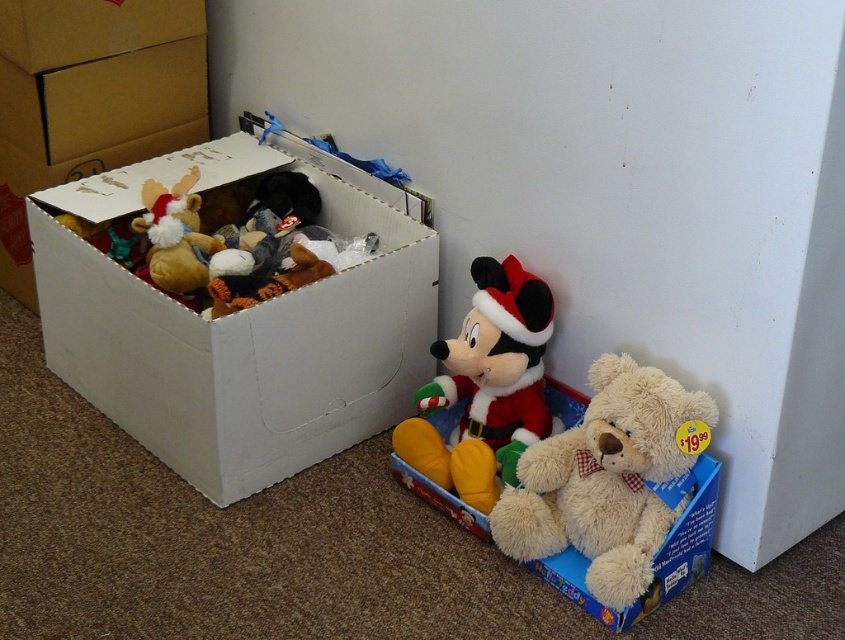
Question: Which point is closer to the camera?

Choices:
 (A) (257, 444)
 (B) (499, 332)

Answer: (B)

Question: Which point is farther to the camera?

Choices:
 (A) fluffy beige teddy bear at lower right
 (B) velvet santa mickey mouse at center

Answer: (B)

Question: Which object is farther from the camera taking this photo?

Choices:
 (A) fluffy beige teddy bear at lower right
 (B) velvet santa mickey mouse at center
 (C) white cardboard box at left

Answer: (B)

Question: Does white cardboard box at left have a smaller size compared to velvet santa mickey mouse at center?

Choices:
 (A) yes
 (B) no

Answer: (B)

Question: Does white cardboard box at left have a lesser width compared to white cardboard box at upper left?

Choices:
 (A) no
 (B) yes

Answer: (A)

Question: Can you confirm if white cardboard box at upper left is thinner than velvet santa mickey mouse at center?

Choices:
 (A) no
 (B) yes

Answer: (A)